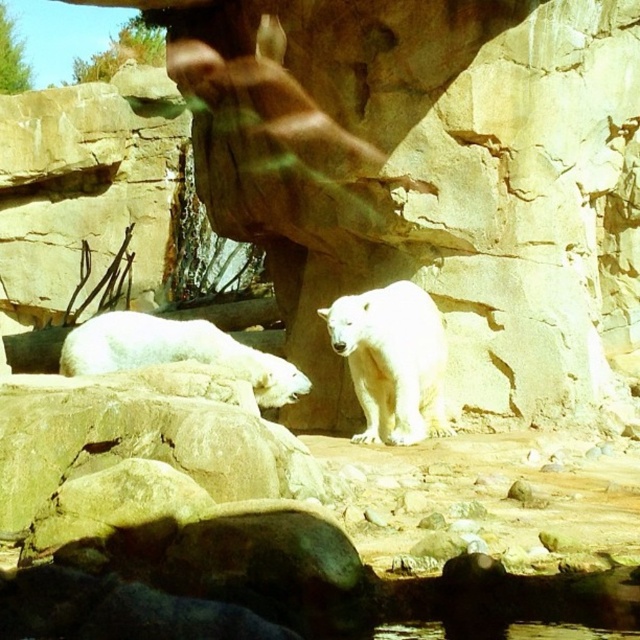
You are a zookeeper standing at the entrance of the polar bear enclosure. You need to determine if you can safely approach the white fur bear at center to provide food. The safety protocol states that you must stay at least 30 meters away from the bears at all times. Can you approach the bear?

The white fur bear at center is 29.65 meters away from the camera. Since the safety protocol requires staying at least 30 meters away, you cannot approach the bear as it is closer than the required distance.

You are a zookeeper who needs to ensure the safety of visitors. The enclosure has a viewing platform that is 15 feet away from the white fur bear at lower left. Can you confirm if the white fur bear at center is within the safe viewing distance of 15 feet from the platform?

The distance between the white fur bear at center and the white fur bear at lower left is 13.02 feet. Since the platform is 15 feet away from the white fur bear at lower left, the white fur bear at center is within the 15 feet safe distance from the platform.